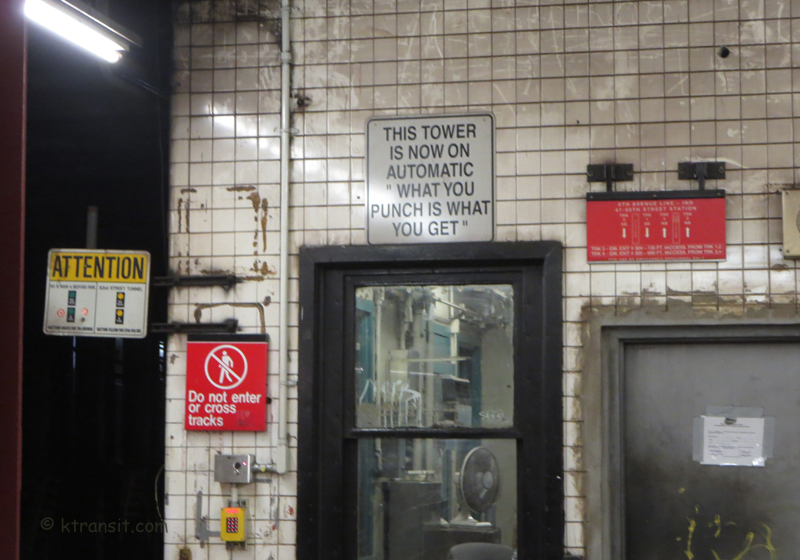
Find the location of `window`. window is located at coordinates (430, 400).